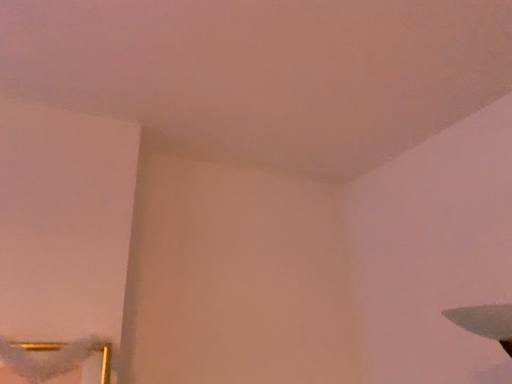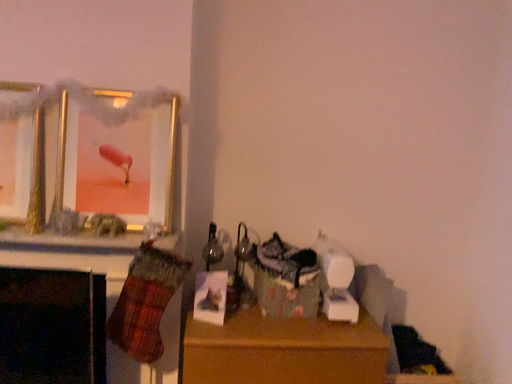
Question: Which way did the camera rotate in the video?

Choices:
 (A) rotated downward
 (B) rotated upward

Answer: (A)